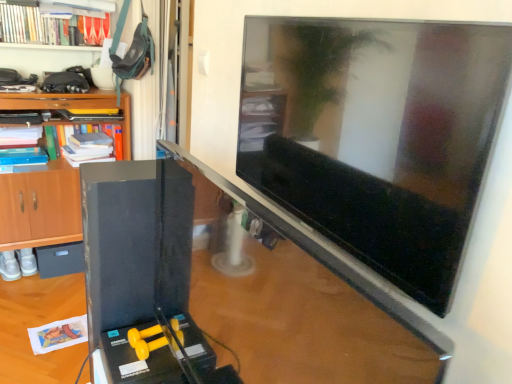
Question: Is black matte drawer at lower left surrounded by wooden cabinet at left?

Choices:
 (A) yes
 (B) no

Answer: (A)

Question: Can you confirm if wooden cabinet at left is taller than black matte drawer at lower left?

Choices:
 (A) no
 (B) yes

Answer: (B)

Question: Is wooden cabinet at left not within black matte drawer at lower left?

Choices:
 (A) no
 (B) yes

Answer: (B)

Question: Is wooden cabinet at left at the right side of black matte drawer at lower left?

Choices:
 (A) yes
 (B) no

Answer: (A)

Question: From the image's perspective, is wooden cabinet at left located beneath black matte drawer at lower left?

Choices:
 (A) no
 (B) yes

Answer: (A)

Question: Is black matte drawer at lower left wider or thinner than satin black monitor at center?

Choices:
 (A) wide
 (B) thin

Answer: (A)

Question: In the image, is black matte drawer at lower left positioned in front of or behind satin black monitor at center?

Choices:
 (A) behind
 (B) front

Answer: (A)

Question: From the image's perspective, is black matte drawer at lower left located above or below satin black monitor at center?

Choices:
 (A) below
 (B) above

Answer: (A)

Question: Visually, is black matte drawer at lower left positioned to the left or to the right of satin black monitor at center?

Choices:
 (A) left
 (B) right

Answer: (A)

Question: Is green matte book at upper left, which is counted as the 2th book, starting from the top, in front of or behind satin black monitor at center in the image?

Choices:
 (A) front
 (B) behind

Answer: (B)

Question: Would you say green matte book at upper left, acting as the 1th book starting from the bottom, is inside or outside satin black monitor at center?

Choices:
 (A) inside
 (B) outside

Answer: (B)

Question: Is point (87, 142) closer or farther from the camera than point (273, 342)?

Choices:
 (A) farther
 (B) closer

Answer: (A)

Question: From the image's perspective, is green matte book at upper left, acting as the 1th book starting from the bottom, positioned above or below satin black monitor at center?

Choices:
 (A) below
 (B) above

Answer: (B)

Question: Is satin black monitor at center inside or outside of black matte drawer at lower left?

Choices:
 (A) inside
 (B) outside

Answer: (B)

Question: Based on their positions, is satin black monitor at center located to the left or right of black matte drawer at lower left?

Choices:
 (A) right
 (B) left

Answer: (A)